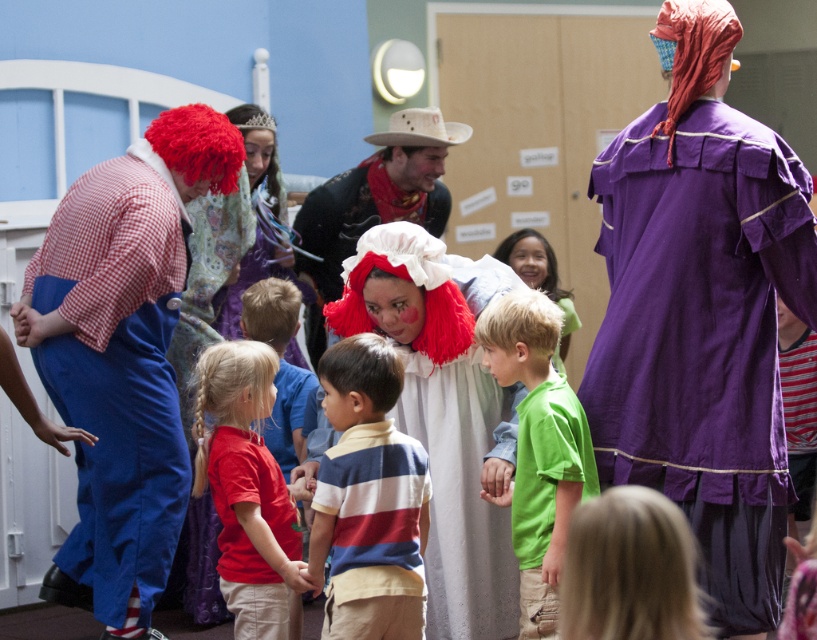
Is green cotton shirt at center below red shirt at center?

Yes, green cotton shirt at center is below red shirt at center.

Does green cotton shirt at center have a lesser width compared to red shirt at center?

In fact, green cotton shirt at center might be wider than red shirt at center.

You are a GUI agent. You are given a task and a screenshot of the screen. Output one action in this format:
    pyautogui.click(x=<x>, y=<y>)
    Task: Click on the green cotton shirt at center
    Image resolution: width=817 pixels, height=640 pixels.
    Given the screenshot: What is the action you would take?
    pyautogui.click(x=538, y=448)

Which of these two, checkered fabric clown at left or red shirt at center, stands taller?

Standing taller between the two is checkered fabric clown at left.

Between checkered fabric clown at left and red shirt at center, which one has less height?

red shirt at center

Between point (188, 173) and point (278, 433), which one is positioned in front?

Positioned in front is point (188, 173).

This screenshot has width=817, height=640. Identify the location of checkered fabric clown at left. (123, 355).

Who is higher up, purple cotton dress at center or red shirt at center?

purple cotton dress at center

Consider the image. Can you confirm if purple cotton dress at center is shorter than red shirt at center?

No, purple cotton dress at center is not shorter than red shirt at center.

What are the coordinates of `purple cotton dress at center` in the screenshot? It's located at (702, 314).

This screenshot has height=640, width=817. I want to click on purple cotton dress at center, so click(x=702, y=314).